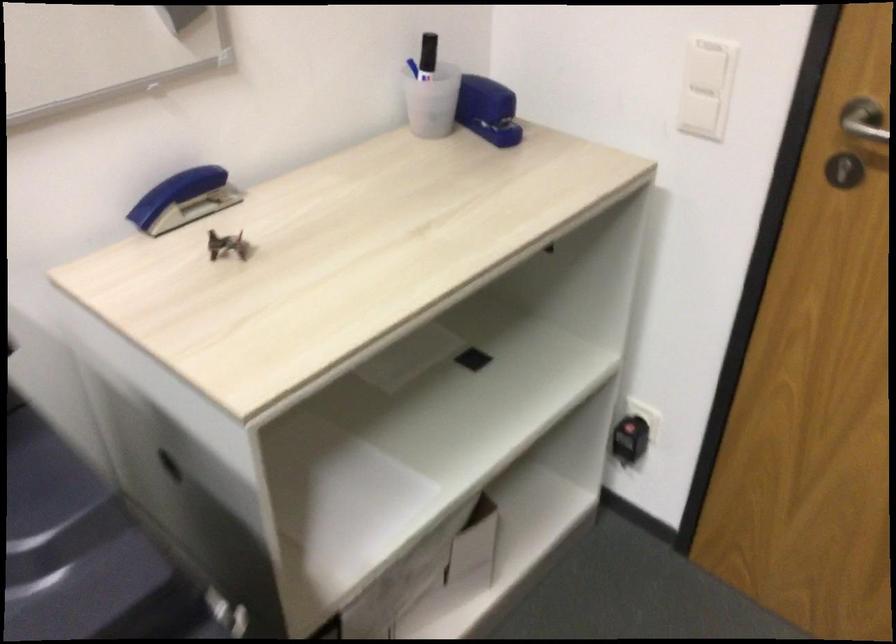
Image resolution: width=896 pixels, height=644 pixels. Describe the element at coordinates (428, 55) in the screenshot. I see `the black marker` at that location.